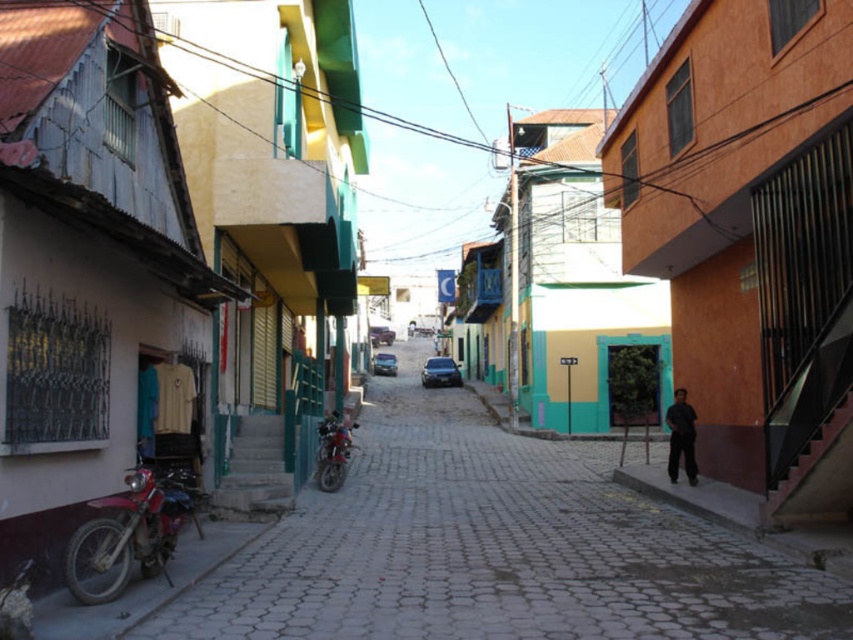
You are a delivery person trying to navigate a narrow street. You see the smooth concrete street at center and the dark gray fabric pants at lower right. Which path is wider for your delivery vehicle?

The smooth concrete street at center is wider than the dark gray fabric pants at lower right, so the delivery vehicle should take the smooth concrete street at center path.

You are a delivery person who needs to park your 2.5 meter long motorcycle between the red matte motorcycle at lower left and the metallic red motorcycle at center. Is there enough space for your motorcycle?

The distance between the red matte motorcycle at lower left and the metallic red motorcycle at center is 7.86 meters. Since your motorcycle is 2.5 meters long, there is sufficient space to park it between them.

You are a delivery driver with a truck that is 2.5 meters wide. You need to drive through the street where the smooth concrete street at center and metallic red motorcycle at center are located. Can your truck pass through this section of the street?

The smooth concrete street at center and metallic red motorcycle at center are 3.90 meters apart from each other. Since the truck is 2.5 meters wide, it can pass through the street as the width between the two objects is sufficient to accommodate the truck.